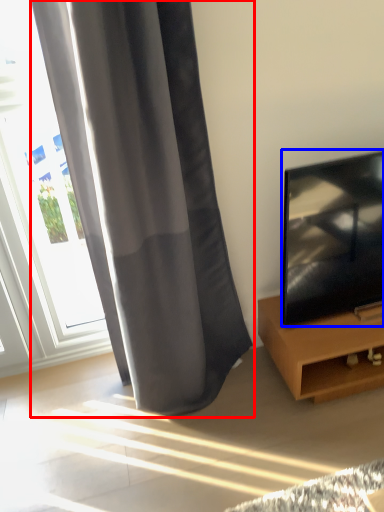
Question: Which object appears closest to the camera in this image, curtain (highlighted by a red box) or television (highlighted by a blue box)?

Choices:
 (A) curtain
 (B) television

Answer: (A)